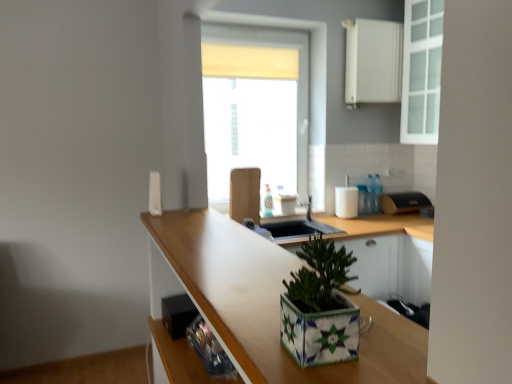
Question: From a real-world perspective, is wooden at center over white matte soap dispenser at upper right, the 3th appliance from the top?

Choices:
 (A) yes
 (B) no

Answer: (B)

Question: Considering the relative positions of wooden at center and white matte soap dispenser at upper right, marked as the 4th appliance in a front-to-back arrangement, in the image provided, is wooden at center to the right of white matte soap dispenser at upper right, marked as the 4th appliance in a front-to-back arrangement, from the viewer's perspective?

Choices:
 (A) no
 (B) yes

Answer: (A)

Question: Considering the relative positions of wooden at center and white matte soap dispenser at upper right, marked as the 4th appliance in a front-to-back arrangement, in the image provided, is wooden at center in front of white matte soap dispenser at upper right, marked as the 4th appliance in a front-to-back arrangement,?

Choices:
 (A) no
 (B) yes

Answer: (B)

Question: Is wooden at center smaller than white matte soap dispenser at upper right, marked as the 4th appliance in a front-to-back arrangement?

Choices:
 (A) yes
 (B) no

Answer: (B)

Question: Is wooden at center wider than white matte soap dispenser at upper right, marked as the 3th appliance in a right-to-left arrangement?

Choices:
 (A) no
 (B) yes

Answer: (B)

Question: Can you confirm if wooden at center is thinner than white matte soap dispenser at upper right, the 3th appliance positioned from the left?

Choices:
 (A) no
 (B) yes

Answer: (A)

Question: Does black textured bread bin at right, which appears as the 5th appliance when viewed from the left, contain white glass cabinet at upper right?

Choices:
 (A) no
 (B) yes

Answer: (A)

Question: Does black textured bread bin at right, which appears as the 5th appliance when viewed from the left, have a lesser width compared to white glass cabinet at upper right?

Choices:
 (A) no
 (B) yes

Answer: (A)

Question: From the image's perspective, is black textured bread bin at right, positioned as the 1th appliance in right-to-left order, on top of white glass cabinet at upper right?

Choices:
 (A) yes
 (B) no

Answer: (B)

Question: From the image's perspective, is black textured bread bin at right, acting as the first appliance starting from the back, beneath white glass cabinet at upper right?

Choices:
 (A) no
 (B) yes

Answer: (B)

Question: Considering the relative positions of black textured bread bin at right, which appears as the 5th appliance when viewed from the left, and white glass cabinet at upper right in the image provided, is black textured bread bin at right, which appears as the 5th appliance when viewed from the left, behind white glass cabinet at upper right?

Choices:
 (A) no
 (B) yes

Answer: (B)

Question: Is black textured bread bin at right, the 2th appliance when ordered from bottom to top, to the left of white glass cabinet at upper right from the viewer's perspective?

Choices:
 (A) yes
 (B) no

Answer: (A)

Question: From the image's perspective, does white matte radiator at upper right, which appears as the 4th appliance when viewed from the left, appear higher than black textured bread bin at right, the fourth appliance positioned from the top?

Choices:
 (A) yes
 (B) no

Answer: (A)